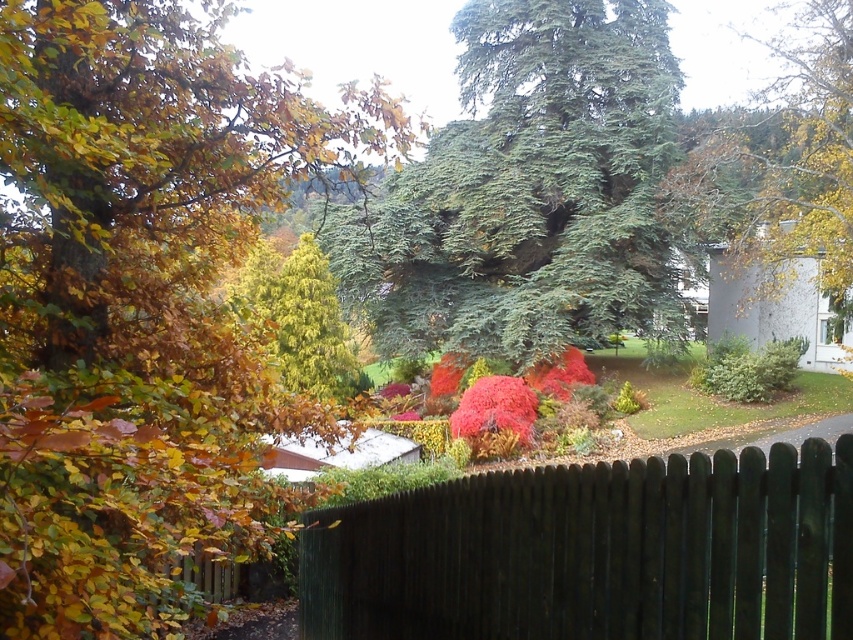
Question: Can you confirm if dark brown wooden fence at lower center is positioned to the right of green needle-like at center?

Choices:
 (A) no
 (B) yes

Answer: (A)

Question: Is dark brown wooden fence at lower center positioned before green needle-like at center?

Choices:
 (A) no
 (B) yes

Answer: (B)

Question: Among these points, which one is farthest from the camera?

Choices:
 (A) (788, 467)
 (B) (500, 104)

Answer: (B)

Question: Can you confirm if dark brown wooden fence at lower center is positioned below green needle-like at center?

Choices:
 (A) yes
 (B) no

Answer: (A)